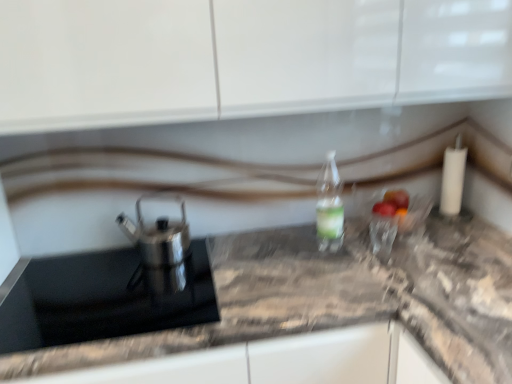
Where is `vacant region above black glass sink at left (from a real-world perspective)`? Image resolution: width=512 pixels, height=384 pixels. vacant region above black glass sink at left (from a real-world perspective) is located at coordinates (123, 289).